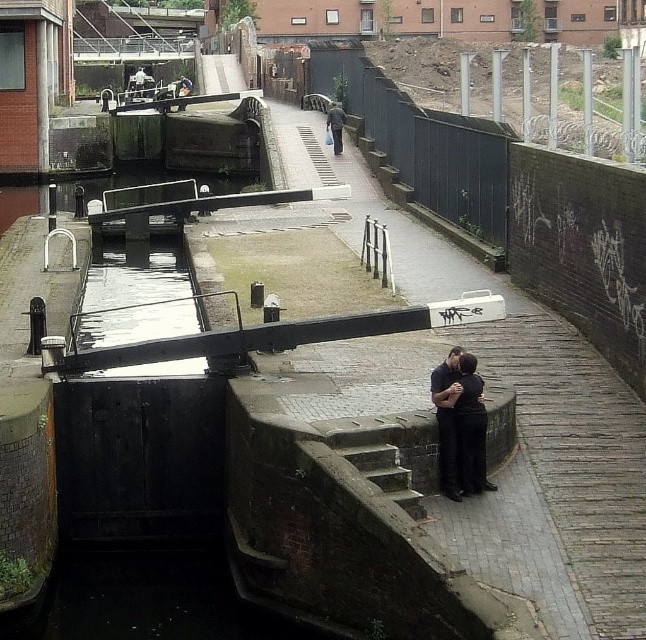
Can you confirm if black smooth couple at center is wider than smooth leather jacket at upper center?

No.

Consider the image. Is black smooth couple at center behind smooth leather jacket at upper center?

No.

Find the location of a particular element. black smooth couple at center is located at coordinates (459, 424).

Does point (337, 125) come behind point (149, 80)?

No.

Does dark gray concrete man at center have a greater width compared to smooth leather jacket at upper center?

No.

Does point (331, 120) lie behind point (140, 76)?

No, it is in front of (140, 76).

Image resolution: width=646 pixels, height=640 pixels. What are the coordinates of `dark gray concrete man at center` in the screenshot? It's located at 335,125.

Is point (461, 358) positioned after point (331, 104)?

No.

Between black smooth couple at center and dark gray concrete man at center, which one appears on the right side from the viewer's perspective?

Positioned to the right is black smooth couple at center.

Locate an element on the screen. The image size is (646, 640). black smooth couple at center is located at coordinates (459, 424).

This screenshot has width=646, height=640. In order to click on black smooth couple at center in this screenshot , I will do `click(459, 424)`.